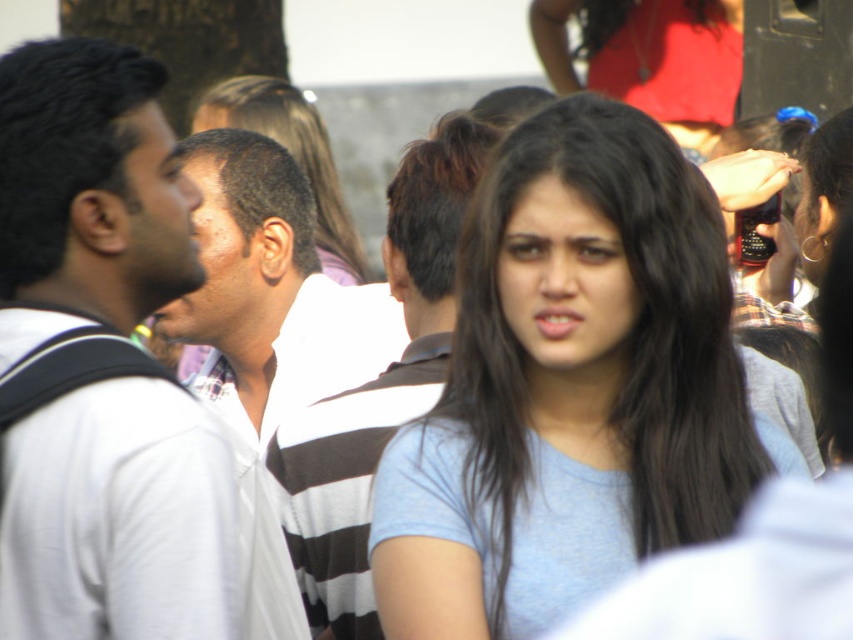
You are at an outdoor event and notice two people wearing striped shirts. One is wearing a white striped shirt at left and the other a striped shirt at center. Based on the scene description, which person is shorter?

The white striped shirt at left is not as tall as striped shirt at center, so the person wearing the white striped shirt at left is shorter.

You are a photographer trying to capture a clear shot of the light blue cotton shirt at center and the white matte shirt at left. Which of the two shirts is positioned lower in the frame?

The light blue cotton shirt at center is positioned lower in the frame than the white matte shirt at left.